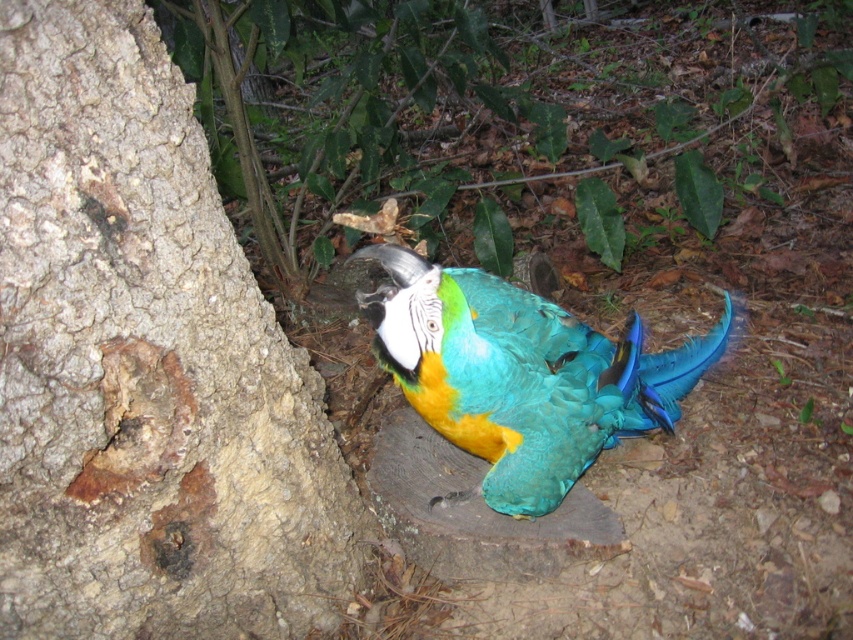
Question: Does rough bark tree trunk at left lie behind shiny teal parrot at center?

Choices:
 (A) no
 (B) yes

Answer: (A)

Question: Is rough bark tree trunk at left further to camera compared to shiny teal parrot at center?

Choices:
 (A) no
 (B) yes

Answer: (A)

Question: Which of the following is the closest to the observer?

Choices:
 (A) (670, 396)
 (B) (64, 12)

Answer: (B)

Question: Can you confirm if rough bark tree trunk at left is positioned to the left of shiny teal parrot at center?

Choices:
 (A) yes
 (B) no

Answer: (A)